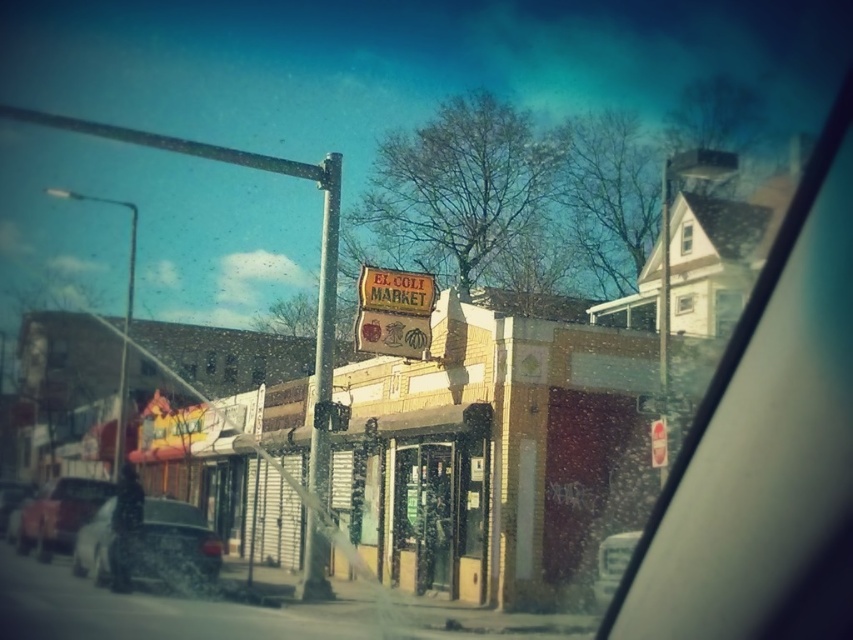
Question: Which of the following is the farthest from the observer?

Choices:
 (A) metallic silver car at lower left
 (B) white plastic air vent at lower right
 (C) white matte car at lower left
 (D) metallic pole at center

Answer: (A)

Question: Is white matte car at lower left to the left of metallic silver car at lower left from the viewer's perspective?

Choices:
 (A) no
 (B) yes

Answer: (A)

Question: Which point is farther to the camera?

Choices:
 (A) (815, 196)
 (B) (154, 579)
 (C) (628, 541)

Answer: (B)

Question: Does metallic silver car at lower left appear on the left side of white plastic air vent at lower right?

Choices:
 (A) no
 (B) yes

Answer: (B)

Question: Which point is closer to the camera?

Choices:
 (A) (422, 355)
 (B) (86, 561)

Answer: (B)

Question: Is wooden signboard at center wider than white plastic air vent at lower right?

Choices:
 (A) yes
 (B) no

Answer: (A)